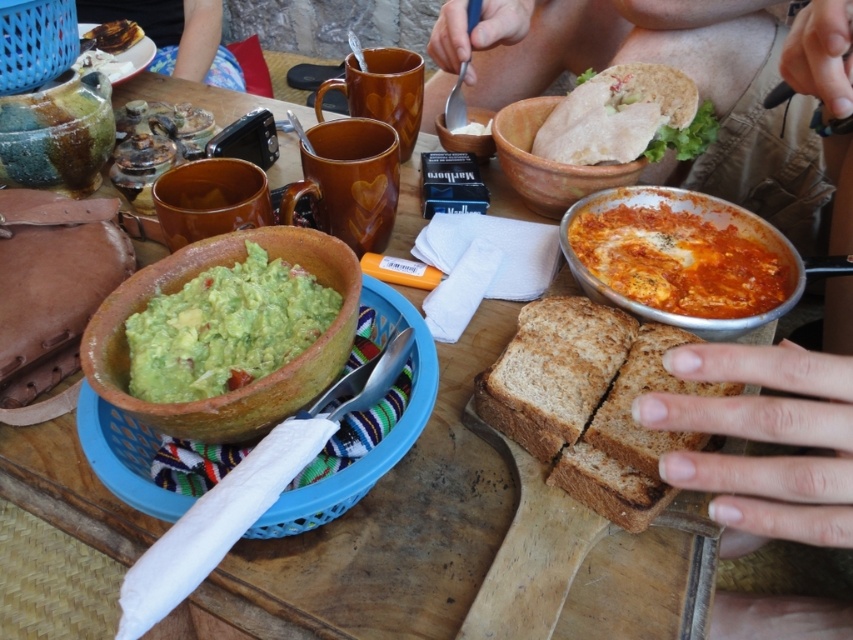
You are a person standing in front of the table and want to grab the skinny beige shorts at upper center. Can you reach it without moving your body?

The skinny beige shorts at upper center is 12.99 inches from viewer, so yes, you can reach it without moving your body since it is within arm reach.

You see two pieces of bread on the table. One is the brown matte bread at center and the other is the matte brown bread at upper right. Which bread is positioned to the left of the other?

The brown matte bread at center is positioned to the left of the matte brown bread at upper right.

You are a guest at the table and want to reach for the brown matte bread at center. However, there is a matte clay bowl at center in the way. Can you easily access the bread without moving the bowl?

The brown matte bread at center is positioned under the matte clay bowl at center, so you cannot easily access it without moving the bowl.